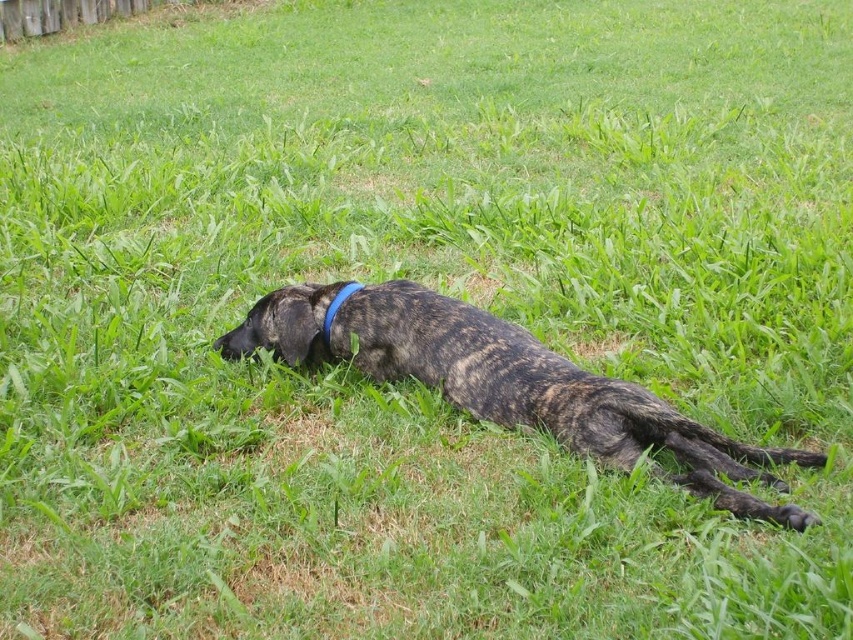
Question: Which of the following is the closest to the observer?

Choices:
 (A) blue fabric neckband at center
 (B) brindle fur dog at center

Answer: (B)

Question: Which object is closer to the camera taking this photo?

Choices:
 (A) brindle fur dog at center
 (B) blue fabric neckband at center

Answer: (A)

Question: Can you confirm if brindle fur dog at center is positioned to the right of blue fabric neckband at center?

Choices:
 (A) no
 (B) yes

Answer: (B)

Question: Considering the relative positions of brindle fur dog at center and blue fabric neckband at center in the image provided, where is brindle fur dog at center located with respect to blue fabric neckband at center?

Choices:
 (A) right
 (B) left

Answer: (A)

Question: Does brindle fur dog at center have a smaller size compared to blue fabric neckband at center?

Choices:
 (A) yes
 (B) no

Answer: (B)